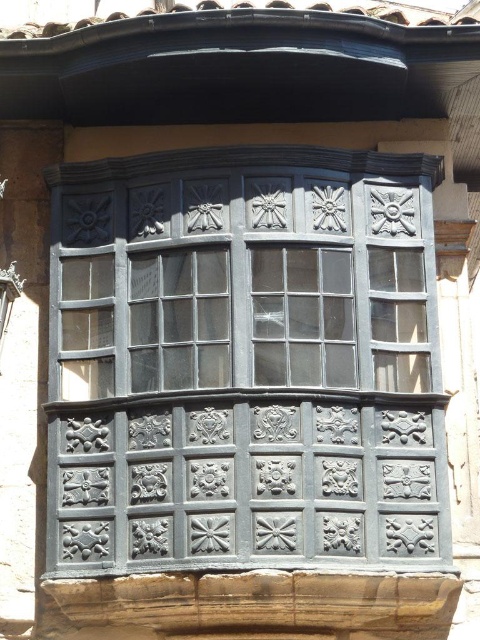
Is point (70, 298) closer to viewer compared to point (280, 371)?

No, (70, 298) is behind (280, 371).

Looking at this image, is matte black window frame at center bigger than clear glass window at center?

Indeed, matte black window frame at center has a larger size compared to clear glass window at center.

Does point (132, 408) come behind point (342, 342)?

No, it is not.

Identify the location of matte black window frame at center. (244, 362).